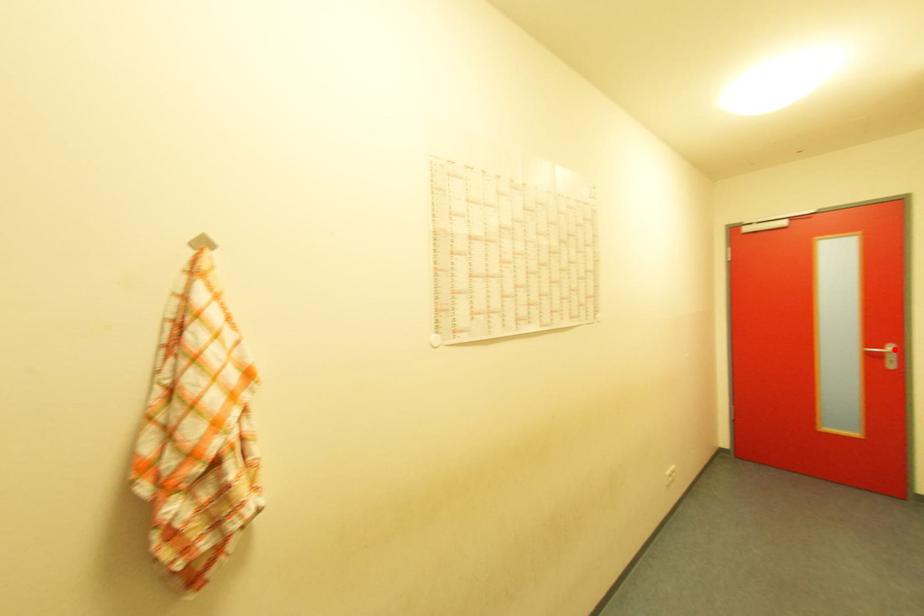
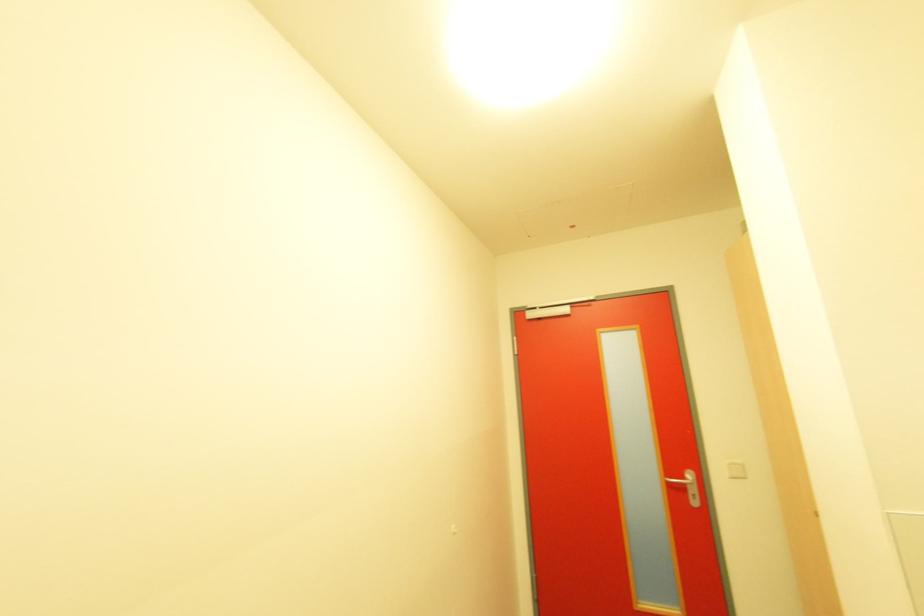
Where in the second image is the point corresponding to the highlighted location from the first image?

(694, 477)